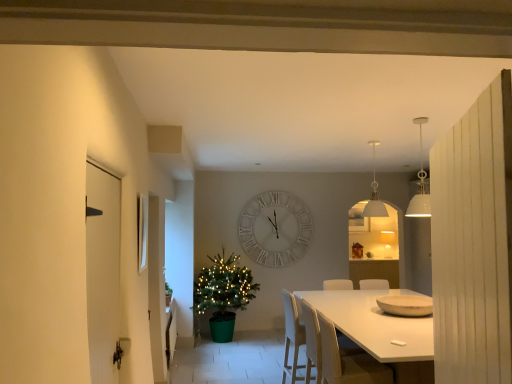
Question: In terms of height, does white glossy picture frame at upper left look taller or shorter compared to matte white lampshade at upper center, the 2th lamp when ordered from top to bottom?

Choices:
 (A) short
 (B) tall

Answer: (A)

Question: From the image's perspective, is white glossy picture frame at upper left above or below matte white lampshade at upper center, the first lamp from the bottom?

Choices:
 (A) below
 (B) above

Answer: (B)

Question: Estimate the real-world distances between objects in this image. Which object is closer to the matte white lampshade at upper center, which appears as the 2th lamp when viewed from the left?

Choices:
 (A) white matte chair at center, acting as the second armchair starting from the front
 (B) white plastic chair at center
 (C) white glossy picture frame at upper left
 (D) white glossy door at left
 (E) light brown wooden chair at lower center, the second armchair when ordered from back to front

Answer: (B)

Question: Estimate the real-world distances between objects in this image. Which object is closer to the white wooden clock at center?

Choices:
 (A) green matte houseplant at left
 (B) white glossy table at center
 (C) white glossy door at left
 (D) green plastic christmas tree at center-left
 (E) light brown wooden chair at lower center, the second armchair when ordered from back to front

Answer: (D)